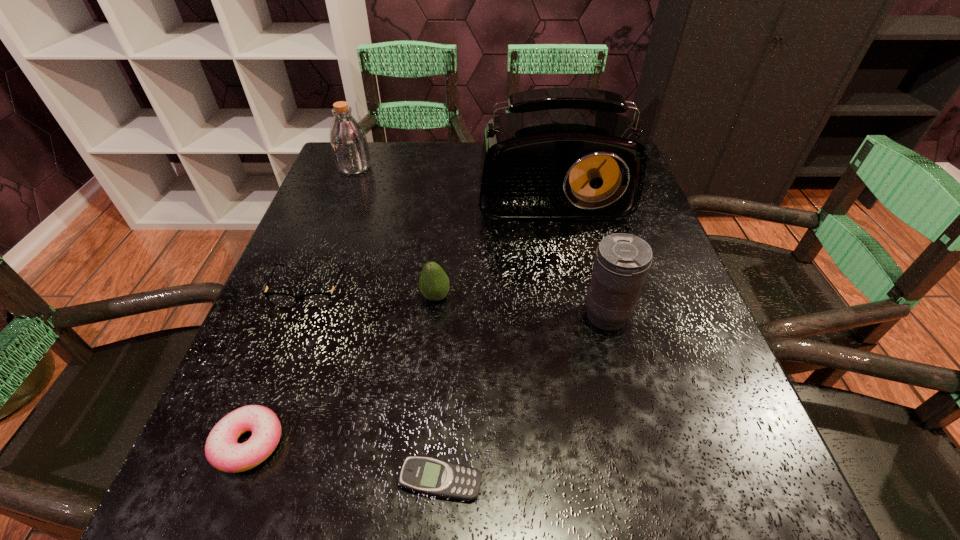
Where is `radio receiver`? radio receiver is located at coordinates (563, 153).

At what (x,y) coordinates should I click in order to perform the action: click on bottle. Please return your answer as a coordinate pair (x, y). Looking at the image, I should click on (348, 141).

Identify the location of telephoto lens. The height and width of the screenshot is (540, 960). (622, 261).

The width and height of the screenshot is (960, 540). I want to click on avocado, so click(x=434, y=284).

Identify the location of spectacles. This screenshot has width=960, height=540. (317, 299).

In order to click on doughnut in this screenshot , I will do `click(222, 451)`.

Identify the location of the shortest object. The image size is (960, 540). tap(435, 477).

Find the location of a particular element. This screenshot has width=960, height=540. vacant region located on the front-facing side of the radio receiver is located at coordinates (590, 374).

Locate an element on the screen. This screenshot has height=540, width=960. vacant space located on the front of the bottle is located at coordinates (311, 282).

You are a GUI agent. You are given a task and a screenshot of the screen. Output one action in this format:
    pyautogui.click(x=<x>, y=<y>)
    Task: Click on the vacant region located on the side of the telephoto lens where the control switches are located
    The image size is (960, 540).
    Given the screenshot: What is the action you would take?
    pyautogui.click(x=444, y=315)